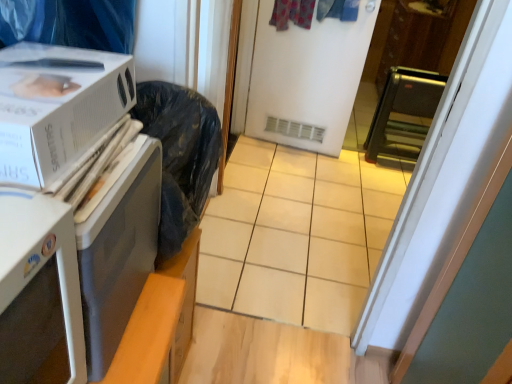
Question: Is point (0, 380) closer or farther from the camera than point (303, 61)?

Choices:
 (A) farther
 (B) closer

Answer: (B)

Question: Considering the positions of white plastic microwave at left, placed as the 1th appliance when sorted from left to right, and white matte screen door at center in the image, is white plastic microwave at left, placed as the 1th appliance when sorted from left to right, wider or thinner than white matte screen door at center?

Choices:
 (A) wide
 (B) thin

Answer: (A)

Question: Estimate the real-world distances between objects in this image. Which object is farther from the white plastic microwave at left, the second appliance viewed from the right?

Choices:
 (A) black metallic toaster oven at right, the second appliance from the left
 (B) white cardboard box at left
 (C) white matte screen door at center

Answer: (A)

Question: Which object is the closest to the white matte screen door at center?

Choices:
 (A) white cardboard box at left
 (B) black metallic toaster oven at right, the 2th appliance in the bottom-to-top sequence
 (C) white plastic microwave at left, placed as the 1th appliance when sorted from left to right

Answer: (B)